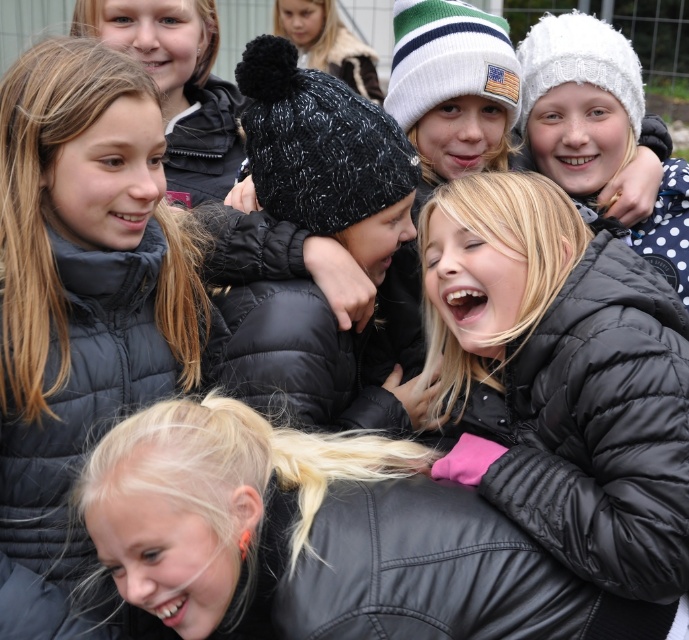
Question: Is black quilted jacket at lower right smaller than black fuzzy beanie at upper center?

Choices:
 (A) yes
 (B) no

Answer: (A)

Question: Does black puffer jacket at center appear under black fuzzy beanie at upper center?

Choices:
 (A) yes
 (B) no

Answer: (A)

Question: Where is black quilted jacket at lower right located in relation to black puffer jacket at center in the image?

Choices:
 (A) left
 (B) right

Answer: (B)

Question: Which of the following is the closest to the observer?

Choices:
 (A) black fuzzy beanie at upper center
 (B) black quilted jacket at lower right

Answer: (B)

Question: Among these objects, which one is nearest to the camera?

Choices:
 (A) black fuzzy beanie at upper center
 (B) black puffer jacket at center

Answer: (B)

Question: Among these objects, which one is farthest from the camera?

Choices:
 (A) black fuzzy beanie at upper center
 (B) black quilted jacket at lower right

Answer: (A)